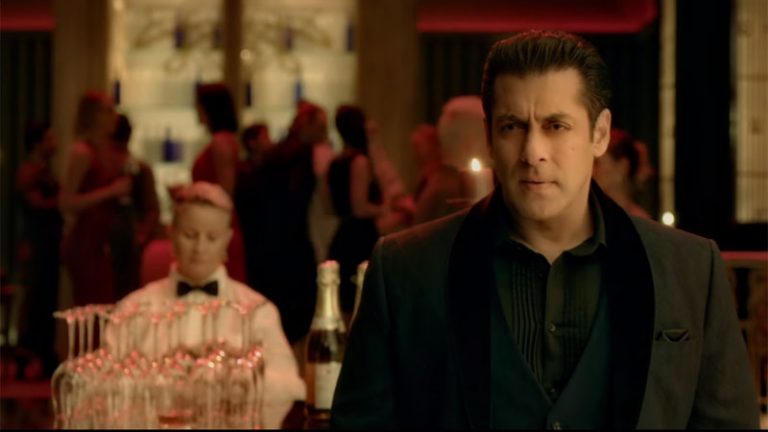
I want to click on upside down champagne glasses, so click(78, 382), click(114, 363), click(130, 395), click(174, 371), click(214, 400), click(247, 371).